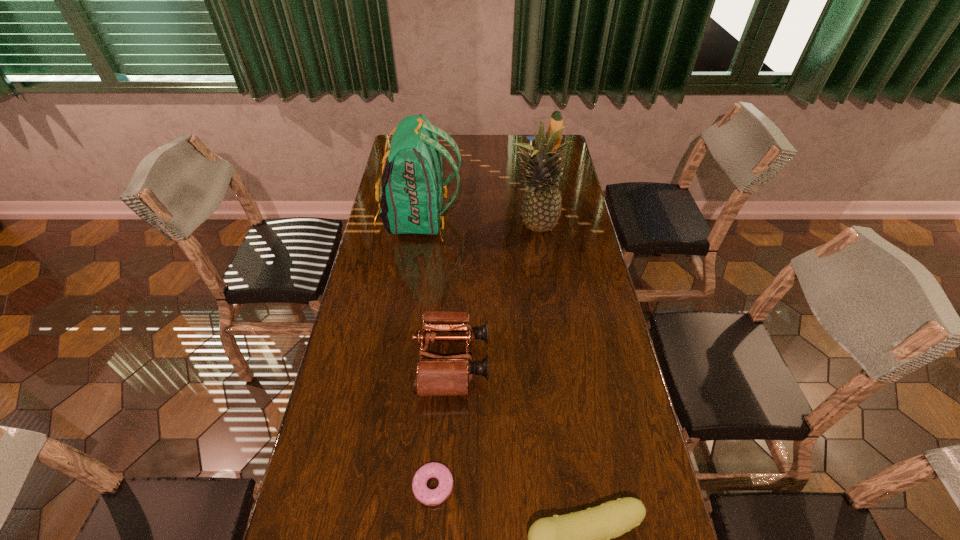
Identify the location of pineapple. The width and height of the screenshot is (960, 540). (541, 207).

The width and height of the screenshot is (960, 540). Identify the location of backpack. (412, 189).

Identify the location of detergent. (556, 119).

Where is `the farthest object`? The height and width of the screenshot is (540, 960). the farthest object is located at coordinates (556, 119).

Where is `the third shortest object`? The width and height of the screenshot is (960, 540). the third shortest object is located at coordinates (437, 375).

Where is `binoculars`? The image size is (960, 540). binoculars is located at coordinates (437, 375).

Identify the location of doughnut. The width and height of the screenshot is (960, 540). (430, 497).

You are a GUI agent. You are given a task and a screenshot of the screen. Output one action in this format:
    pyautogui.click(x=<x>, y=<y>)
    Task: Click on the vacant space positioned 0.070m on the back of the pineapple
    The image size is (960, 540).
    Given the screenshot: What is the action you would take?
    pyautogui.click(x=530, y=202)

Where is `blank area located on the back of the backpack`? Image resolution: width=960 pixels, height=540 pixels. blank area located on the back of the backpack is located at coordinates (488, 219).

What are the coordinates of `free region located 0.340m on the label of the fourth shortest object` in the screenshot? It's located at (464, 177).